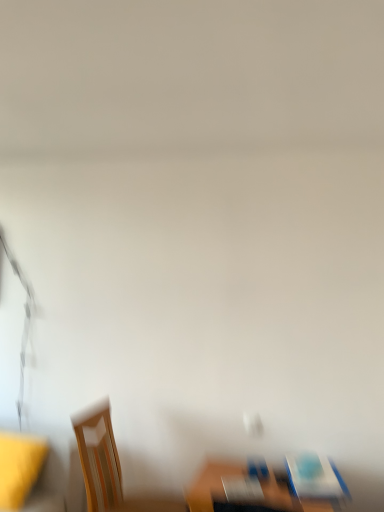
Question: From the image's perspective, relative to wooden table at lower center, is matte wood chair at lower right, which is the 2th chair from left to right, above or below?

Choices:
 (A) above
 (B) below

Answer: (A)

Question: In the image, is matte wood chair at lower right, which is the second chair from bottom to top, on the left side or the right side of wooden table at lower center?

Choices:
 (A) left
 (B) right

Answer: (B)

Question: Which of these objects is positioned farthest from the wooden table at lower center?

Choices:
 (A) yellow fabric at left
 (B) matte wood chair at lower right, acting as the 1th chair starting from the top
 (C) wooden chair at lower left, the first chair when ordered from bottom to top

Answer: (A)

Question: Which object is the farthest from the wooden chair at lower left, marked as the 2th chair in a right-to-left arrangement?

Choices:
 (A) yellow fabric at left
 (B) wooden table at lower center
 (C) matte wood chair at lower right, which is the second chair from bottom to top

Answer: (C)